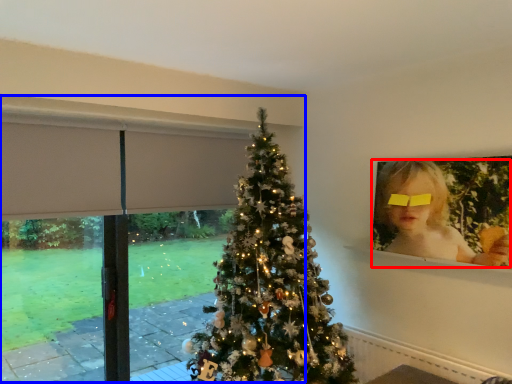
Question: Among these objects, which one is farthest to the camera, person (highlighted by a red box) or window frame (highlighted by a blue box)?

Choices:
 (A) person
 (B) window frame

Answer: (B)